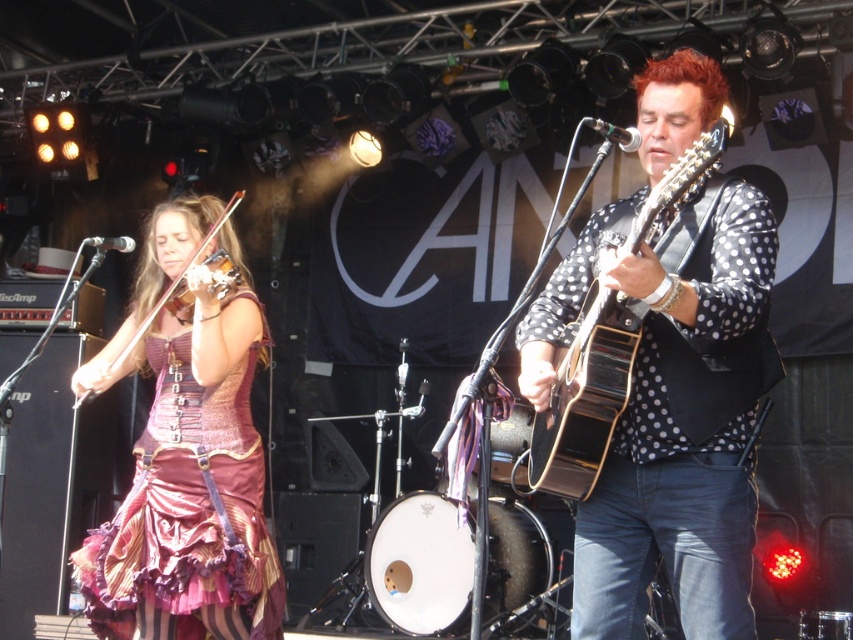
Question: Considering the real-world distances, which object is closest to the shiny purple fabric dress at left?

Choices:
 (A) shiny purple violin at left
 (B) wooden acoustic guitar at center

Answer: (A)

Question: Can you confirm if shiny purple fabric dress at left is positioned below shiny purple violin at left?

Choices:
 (A) no
 (B) yes

Answer: (B)

Question: Which point is closer to the camera?

Choices:
 (A) shiny purple fabric dress at left
 (B) shiny purple violin at left
 (C) wooden acoustic guitar at center

Answer: (C)

Question: Which point appears closest to the camera in this image?

Choices:
 (A) (549, 413)
 (B) (225, 291)

Answer: (A)

Question: Is wooden acoustic guitar at center thinner than shiny purple violin at left?

Choices:
 (A) no
 (B) yes

Answer: (B)

Question: In this image, where is wooden acoustic guitar at center located relative to shiny purple violin at left?

Choices:
 (A) left
 (B) right

Answer: (B)